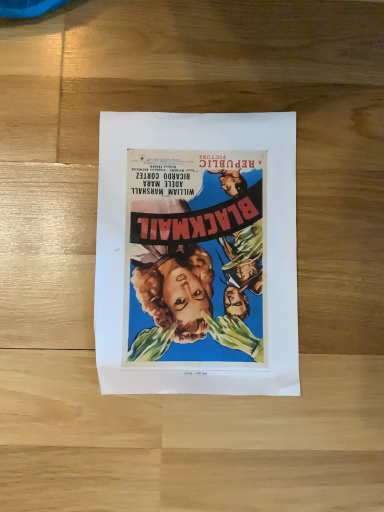
At what (x,y) coordinates should I click in order to perform the action: click on empty space that is ontop of vibrant paper poster at center (from a real-world perspective). Please return your answer as a coordinate pair (x, y). Looking at the image, I should click on (198, 252).